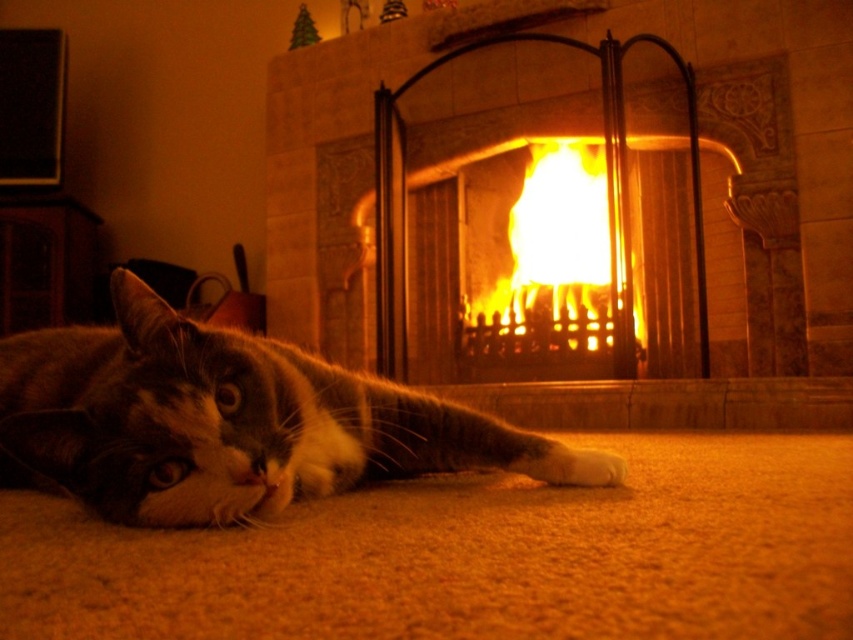
Question: Does tabby fur cat at lower left appear on the left side of matte stone fireplace at center?

Choices:
 (A) yes
 (B) no

Answer: (B)

Question: Among these points, which one is farthest from the camera?

Choices:
 (A) (567, 298)
 (B) (630, 19)
 (C) (41, 464)

Answer: (A)

Question: Does matte stone fireplace at center have a lesser width compared to flamematerial/texture at center?

Choices:
 (A) yes
 (B) no

Answer: (B)

Question: Which object is farther from the camera taking this photo?

Choices:
 (A) flamematerial/texture at center
 (B) tabby fur cat at lower left
 (C) matte stone fireplace at center

Answer: (C)

Question: Which point appears farthest from the camera in this image?

Choices:
 (A) (791, 397)
 (B) (529, 168)
 (C) (132, 296)

Answer: (B)

Question: From the image, what is the correct spatial relationship of matte stone fireplace at center in relation to flamematerial/texture at center?

Choices:
 (A) right
 (B) left

Answer: (B)